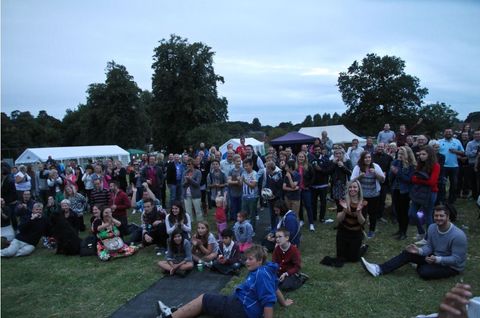
Identify the location of grey rug on ground. (182, 290).